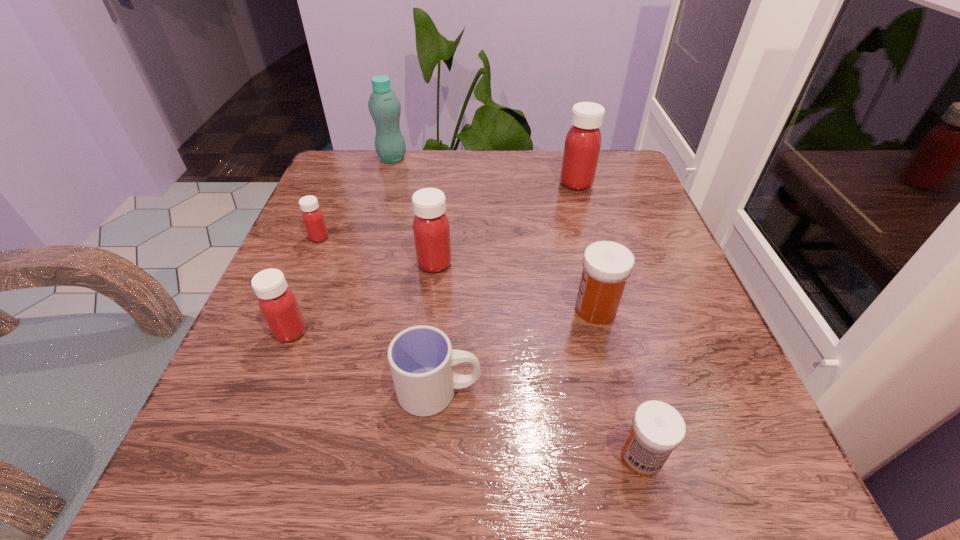
This screenshot has width=960, height=540. What are the coordinates of `vacant point located between the fifth nearest object and the cup` in the screenshot? It's located at (437, 327).

The width and height of the screenshot is (960, 540). In order to click on free space between the farther white medicine and the nearest object in this screenshot , I will do `click(618, 383)`.

At what (x,y) coordinates should I click in order to perform the action: click on vacant area between the third nearest red medicine and the nearer white medicine. Please return your answer as a coordinate pair (x, y). The image size is (960, 540). Looking at the image, I should click on (480, 347).

The height and width of the screenshot is (540, 960). Find the location of `free spot between the third biggest red medicine and the fourth nearest medicine`. free spot between the third biggest red medicine and the fourth nearest medicine is located at coordinates (363, 298).

What are the coordinates of `object that can be found as the sixth closest to the bigger white medicine` in the screenshot? It's located at (312, 216).

Select which object appears as the second closest to the nearest red medicine. Please provide its 2D coordinates. Your answer should be formatted as a tuple, i.e. [(x, y)], where the tuple contains the x and y coordinates of a point satisfying the conditions above.

[(431, 228)]

You are a GUI agent. You are given a task and a screenshot of the screen. Output one action in this format:
    pyautogui.click(x=<x>, y=<y>)
    Task: Click on the medicine that can be found as the closest to the bigger white medicine
    
    Given the screenshot: What is the action you would take?
    657,429

What are the coordinates of `the fourth closest medicine to the nearest red medicine` in the screenshot? It's located at (657, 429).

What are the coordinates of `red medicine that stands as the fourth closest to the farther white medicine` in the screenshot? It's located at (312, 216).

You are a GUI agent. You are given a task and a screenshot of the screen. Output one action in this format:
    pyautogui.click(x=<x>, y=<y>)
    Task: Click on the red medicine that stands as the fourth closest to the cup
    
    Given the screenshot: What is the action you would take?
    pyautogui.click(x=583, y=141)